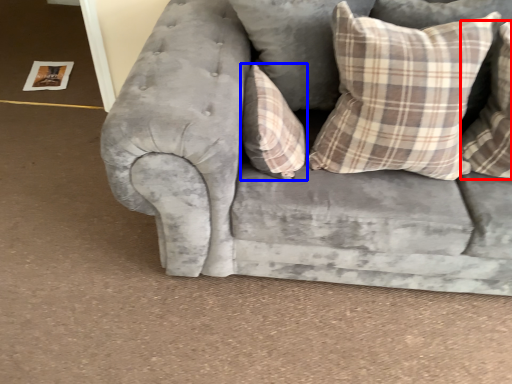
Question: Which of the following is the farthest to the observer, pillow (highlighted by a red box) or pillow (highlighted by a blue box)?

Choices:
 (A) pillow
 (B) pillow

Answer: (B)